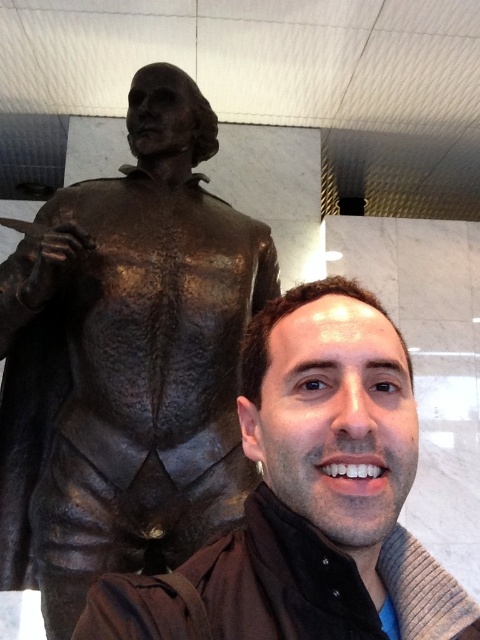
Question: Which of the following is the farthest from the observer?

Choices:
 (A) matte bronze statue at left
 (B) bronze statue at left

Answer: (B)

Question: Observing the image, what is the correct spatial positioning of bronze statue at left in reference to matte bronze statue at left?

Choices:
 (A) below
 (B) above

Answer: (B)

Question: Among these points, which one is farthest from the camera?

Choices:
 (A) pos(462,602)
 (B) pos(176,486)

Answer: (B)

Question: Does bronze statue at left appear on the right side of matte bronze statue at left?

Choices:
 (A) no
 (B) yes

Answer: (A)

Question: Observing the image, what is the correct spatial positioning of bronze statue at left in reference to matte bronze statue at left?

Choices:
 (A) right
 (B) left

Answer: (B)